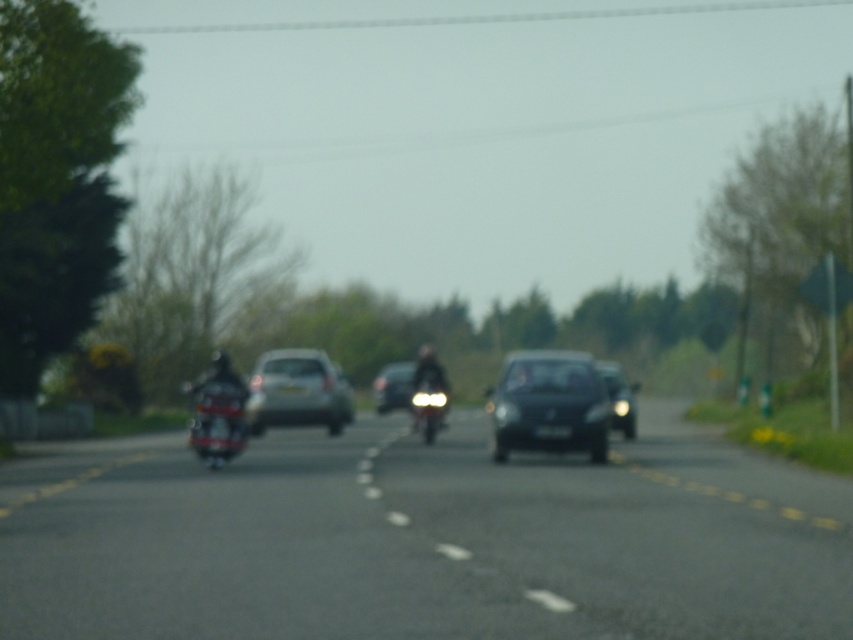
Question: Does black glossy van at center have a greater width compared to matte black car at center?

Choices:
 (A) yes
 (B) no

Answer: (A)

Question: Is silver metallic hatchback at center positioned at the back of shiny red motorcycle at left?

Choices:
 (A) yes
 (B) no

Answer: (A)

Question: Which object is positioned closest to the matte black car at center?

Choices:
 (A) silver metallic hatchback at center
 (B) black glossy van at center

Answer: (A)

Question: Which point is closer to the camera?

Choices:
 (A) (329, 410)
 (B) (610, 394)

Answer: (B)

Question: Does shiny red motorcycle at left appear on the right side of shiny chrome motorcycle at center?

Choices:
 (A) yes
 (B) no

Answer: (B)

Question: Which point is closer to the camera?

Choices:
 (A) (431, 429)
 (B) (563, 442)
 (C) (735, 584)
 (D) (300, 376)

Answer: (C)